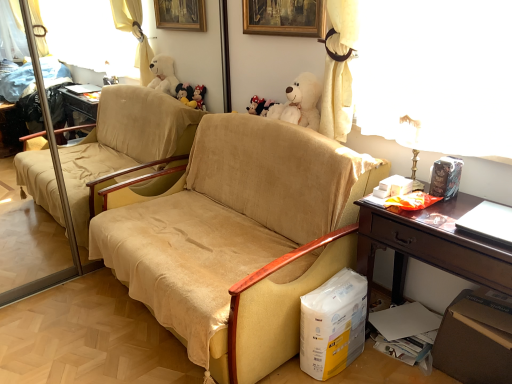
Find the location of a particular element. Image resolution: width=512 pixels, height=384 pixels. empty space that is ontop of brown wooden desk at right (from a real-world perspective) is located at coordinates (443, 205).